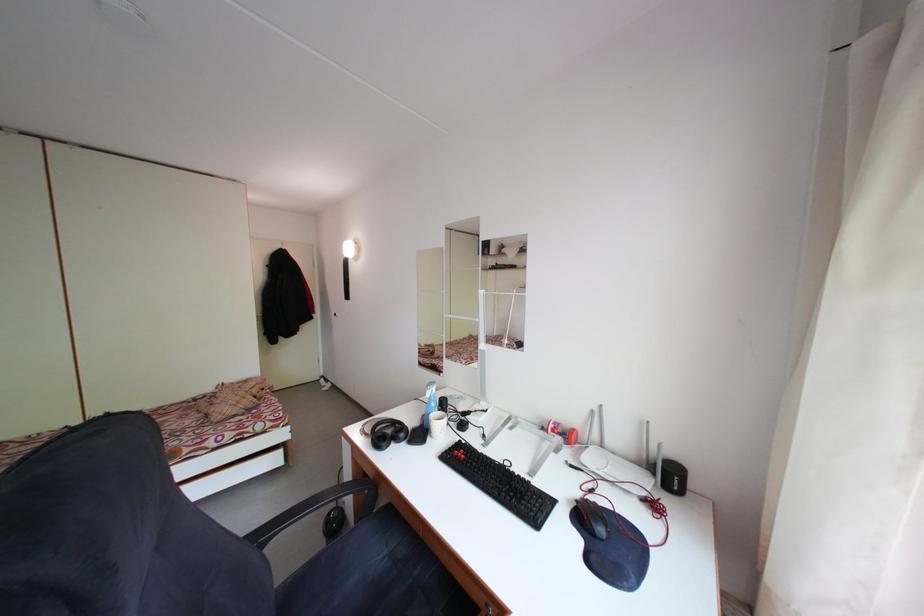
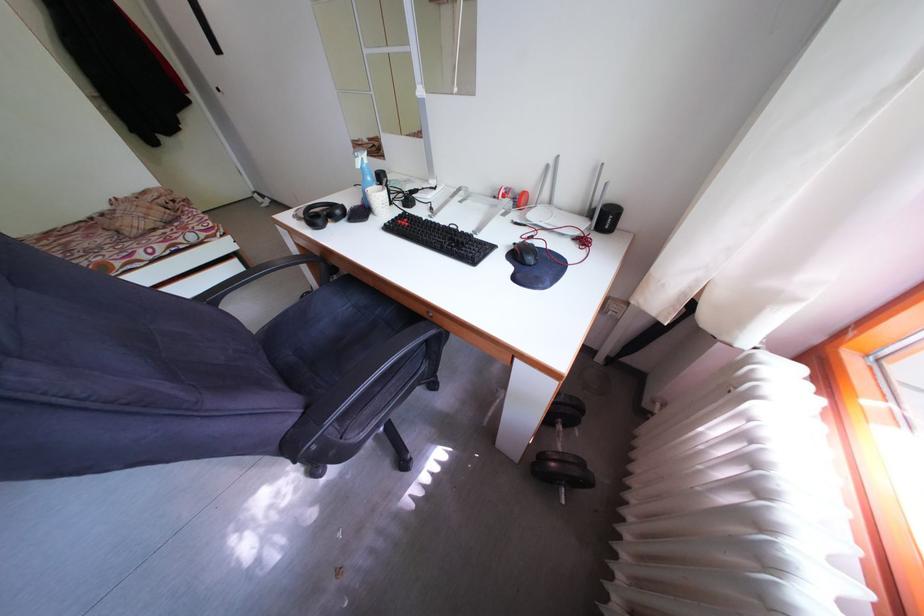
Locate, in the second image, the point that corresponds to pixel 424 580 in the first image.

(385, 318)